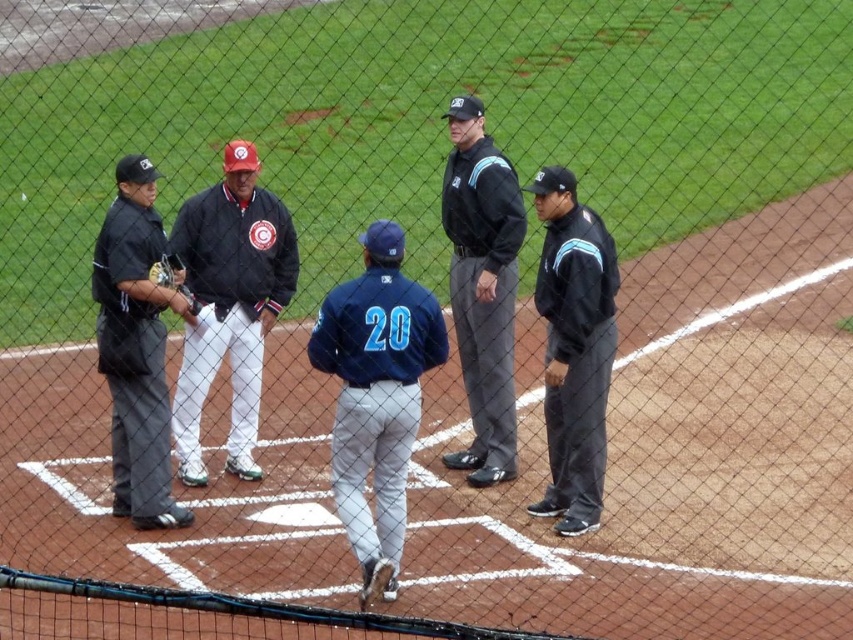
You are a photographer standing behind the chain link fence at the baseball field. You want to take a clear photo of the brown leather glove at left. However, the black uniformed man at left is blocking your view. Can you move to the right or left to get a better angle?

The black uniformed man at left is closer to the viewer than the brown leather glove at left. Moving to the left might allow you to go around the man and get a clearer shot of the glove.

You are standing at the center of the baseball field and want to locate the matte black jacket at center. According to the coordinates given, in which direction should you look to find it?

The matte black jacket at center is located at coordinates point (573, 348). Since the center of the field is typically at coordinate point (426, 320), the jacket is slightly to the northeast direction from the center.

You are standing at the center of the baseball field and see the black uniformed man at left. Based on his position, which direction should you walk to reach him?

The black uniformed man at left is located at point (x=136, y=348), which is to the left side of the field. You should walk towards the left direction to reach him.